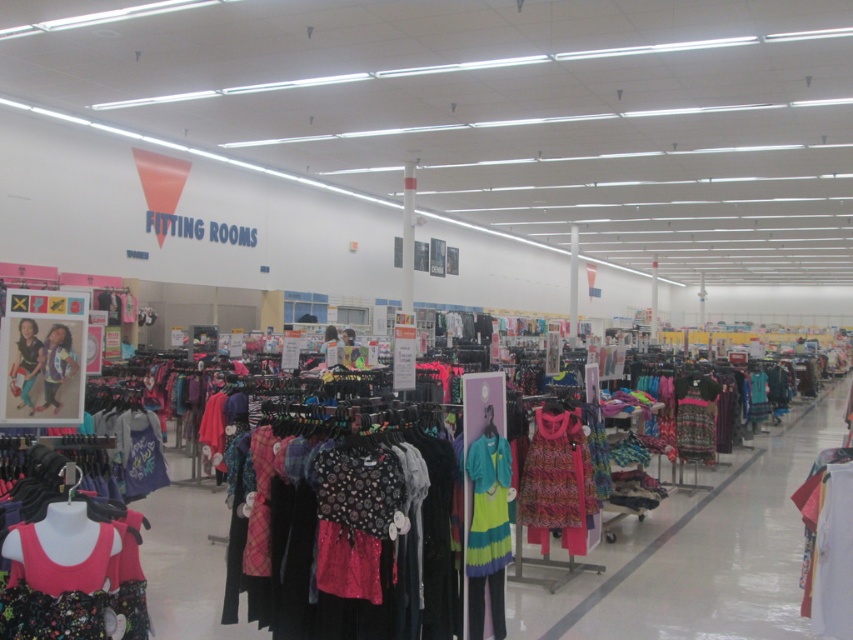
You are standing in the children clothing section of the store. You see two points marked on the floor at coordinates point (62, 504) and point (30, 397). Which point is closer to you?

Point (62, 504) is closer to the camera than point (30, 397), so the point closer to you is point (62, 504).

You are a customer in the children clothing section of a store. You see a printed cotton dress at center and a matte pink dress at center. Which dress is taller?

The printed cotton dress at center is taller than the matte pink dress at center.